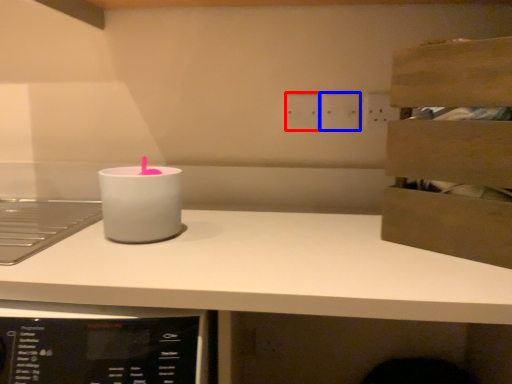
Question: Among these objects, which one is farthest to the camera, electric outlet (highlighted by a red box) or electric outlet (highlighted by a blue box)?

Choices:
 (A) electric outlet
 (B) electric outlet

Answer: (A)